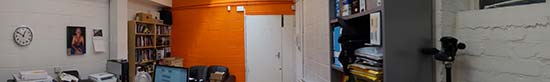
Identify the location of printer. The height and width of the screenshot is (82, 550). (101, 77).